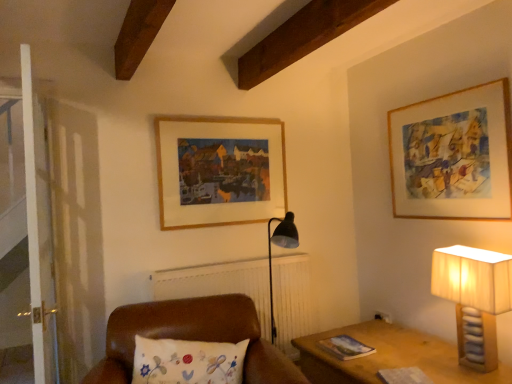
The image size is (512, 384). Describe the element at coordinates (474, 298) in the screenshot. I see `beige fabric lampshade at right` at that location.

The height and width of the screenshot is (384, 512). What do you see at coordinates (453, 155) in the screenshot?
I see `wooden frame at upper right, positioned as the 1th picture frame in right-to-left order` at bounding box center [453, 155].

The width and height of the screenshot is (512, 384). I want to click on leather cushion at center, so click(x=192, y=337).

The height and width of the screenshot is (384, 512). I want to click on beige fabric lampshade at right, so click(x=474, y=298).

Measure the distance from wooden picture frame at upper center, arranged as the 2th picture frame when viewed from the right, to beige fabric lampshade at right.

wooden picture frame at upper center, arranged as the 2th picture frame when viewed from the right, is 4.56 feet from beige fabric lampshade at right.

Where is `lamp below the wooden picture frame at upper center, placed as the first picture frame when sorted from left to right (from a real-world perspective)`? lamp below the wooden picture frame at upper center, placed as the first picture frame when sorted from left to right (from a real-world perspective) is located at coordinates (474, 298).

Looking at this image, from the image's perspective, which object appears higher, wooden picture frame at upper center, placed as the first picture frame when sorted from left to right, or beige fabric lampshade at right?

From the image's view, wooden picture frame at upper center, placed as the first picture frame when sorted from left to right, is above.

Could beige fabric lampshade at right be considered to be inside wooden picture frame at upper center, placed as the first picture frame when sorted from left to right?

No, wooden picture frame at upper center, placed as the first picture frame when sorted from left to right, does not contain beige fabric lampshade at right.

Is wooden frame at upper right, positioned as the 1th picture frame in right-to-left order, oriented away from wooden picture frame at upper center, placed as the first picture frame when sorted from left to right?

wooden frame at upper right, positioned as the 1th picture frame in right-to-left order, is not turned away from wooden picture frame at upper center, placed as the first picture frame when sorted from left to right.

Considering their positions, is wooden frame at upper right, positioned as the 1th picture frame in right-to-left order, located in front of or behind wooden picture frame at upper center, arranged as the 2th picture frame when viewed from the right?

Visually, wooden frame at upper right, positioned as the 1th picture frame in right-to-left order, is located in front of wooden picture frame at upper center, arranged as the 2th picture frame when viewed from the right.

Can you confirm if wooden frame at upper right, positioned as the 1th picture frame in right-to-left order, is positioned to the right of wooden picture frame at upper center, placed as the first picture frame when sorted from left to right?

Yes.

Can you tell me how much wooden frame at upper right, the second picture frame in the left-to-right sequence, and wooden picture frame at upper center, placed as the first picture frame when sorted from left to right, differ in facing direction?

The facing directions of wooden frame at upper right, the second picture frame in the left-to-right sequence, and wooden picture frame at upper center, placed as the first picture frame when sorted from left to right, are 90.2 degrees apart.

Is wooden frame at upper right, positioned as the 1th picture frame in right-to-left order, in contact with leather cushion at center?

No, wooden frame at upper right, positioned as the 1th picture frame in right-to-left order, is not making contact with leather cushion at center.

From the image's perspective, is wooden frame at upper right, the second picture frame in the left-to-right sequence, above or below leather cushion at center?

wooden frame at upper right, the second picture frame in the left-to-right sequence, is situated higher than leather cushion at center in the image.

Is wooden frame at upper right, positioned as the 1th picture frame in right-to-left order, closer to the viewer compared to leather cushion at center?

No, it is behind leather cushion at center.

Is point (242, 164) positioned after point (444, 132)?

Yes, point (242, 164) is behind point (444, 132).

Which object is positioned more to the right, wooden picture frame at upper center, placed as the first picture frame when sorted from left to right, or wooden frame at upper right, the second picture frame in the left-to-right sequence?

wooden frame at upper right, the second picture frame in the left-to-right sequence.

This screenshot has height=384, width=512. Find the location of `picture frame lying above the wooden picture frame at upper center, placed as the first picture frame when sorted from left to right (from the image's perspective)`. picture frame lying above the wooden picture frame at upper center, placed as the first picture frame when sorted from left to right (from the image's perspective) is located at coordinates (453, 155).

Is there a large distance between wooden picture frame at upper center, arranged as the 2th picture frame when viewed from the right, and wooden frame at upper right, positioned as the 1th picture frame in right-to-left order?

Yes, wooden picture frame at upper center, arranged as the 2th picture frame when viewed from the right, and wooden frame at upper right, positioned as the 1th picture frame in right-to-left order, are located far from each other.

Which is closer to the camera, (441, 269) or (486, 152)?

The point (441, 269) is closer.

From the image's perspective, which one is positioned higher, beige fabric lampshade at right or wooden frame at upper right, the second picture frame in the left-to-right sequence?

wooden frame at upper right, the second picture frame in the left-to-right sequence, is shown above in the image.

Can you confirm if beige fabric lampshade at right is positioned to the right of wooden frame at upper right, the second picture frame in the left-to-right sequence?

Yes.

Is beige fabric lampshade at right next to leather cushion at center?

There is a gap between beige fabric lampshade at right and leather cushion at center.

Which object is positioned more to the right, beige fabric lampshade at right or leather cushion at center?

beige fabric lampshade at right is more to the right.

Is beige fabric lampshade at right bigger than leather cushion at center?

No, beige fabric lampshade at right is not bigger than leather cushion at center.

Measure the distance from beige fabric lampshade at right to leather cushion at center.

beige fabric lampshade at right and leather cushion at center are 1.07 meters apart.

Is beige fabric lampshade at right located outside wooden picture frame at upper center, placed as the first picture frame when sorted from left to right?

Indeed, beige fabric lampshade at right is completely outside wooden picture frame at upper center, placed as the first picture frame when sorted from left to right.

Does beige fabric lampshade at right touch wooden picture frame at upper center, arranged as the 2th picture frame when viewed from the right?

beige fabric lampshade at right and wooden picture frame at upper center, arranged as the 2th picture frame when viewed from the right, are not in contact.

Considering the sizes of objects beige fabric lampshade at right and wooden picture frame at upper center, placed as the first picture frame when sorted from left to right, in the image provided, who is smaller, beige fabric lampshade at right or wooden picture frame at upper center, placed as the first picture frame when sorted from left to right,?

With smaller size is wooden picture frame at upper center, placed as the first picture frame when sorted from left to right.

Considering the relative positions of beige fabric lampshade at right and wooden picture frame at upper center, arranged as the 2th picture frame when viewed from the right, in the image provided, is beige fabric lampshade at right to the left or to the right of wooden picture frame at upper center, arranged as the 2th picture frame when viewed from the right,?

beige fabric lampshade at right is to the right of wooden picture frame at upper center, arranged as the 2th picture frame when viewed from the right.

Find the location of a particular element. The image size is (512, 384). lamp located underneath the wooden picture frame at upper center, placed as the first picture frame when sorted from left to right (from a real-world perspective) is located at coordinates (474, 298).

I want to click on picture frame above the wooden frame at upper right, the second picture frame in the left-to-right sequence (from a real-world perspective), so coord(219,170).

Considering their positions, is leather cushion at center positioned further to wooden picture frame at upper center, arranged as the 2th picture frame when viewed from the right, than beige fabric lampshade at right?

The object further to wooden picture frame at upper center, arranged as the 2th picture frame when viewed from the right, is beige fabric lampshade at right.

Estimate the real-world distances between objects in this image. Which object is further from leather cushion at center, wooden picture frame at upper center, arranged as the 2th picture frame when viewed from the right, or wooden frame at upper right, positioned as the 1th picture frame in right-to-left order?

The object further to leather cushion at center is wooden frame at upper right, positioned as the 1th picture frame in right-to-left order.

Which object lies further to the anchor point wooden frame at upper right, the second picture frame in the left-to-right sequence, leather cushion at center or beige fabric lampshade at right?

Among the two, leather cushion at center is located further to wooden frame at upper right, the second picture frame in the left-to-right sequence.

Which object lies nearer to the anchor point wooden picture frame at upper center, placed as the first picture frame when sorted from left to right, wooden frame at upper right, the second picture frame in the left-to-right sequence, or leather cushion at center?

Based on the image, leather cushion at center appears to be nearer to wooden picture frame at upper center, placed as the first picture frame when sorted from left to right.

Based on their spatial positions, is leather cushion at center or wooden picture frame at upper center, arranged as the 2th picture frame when viewed from the right, further from wooden frame at upper right, positioned as the 1th picture frame in right-to-left order?

leather cushion at center is positioned further to the anchor wooden frame at upper right, positioned as the 1th picture frame in right-to-left order.

Which object lies nearer to the anchor point wooden frame at upper right, positioned as the 1th picture frame in right-to-left order, beige fabric lampshade at right or wooden picture frame at upper center, arranged as the 2th picture frame when viewed from the right?

beige fabric lampshade at right is positioned closer to the anchor wooden frame at upper right, positioned as the 1th picture frame in right-to-left order.

Based on their spatial positions, is wooden picture frame at upper center, arranged as the 2th picture frame when viewed from the right, or beige fabric lampshade at right closer to leather cushion at center?

wooden picture frame at upper center, arranged as the 2th picture frame when viewed from the right, is positioned closer to the anchor leather cushion at center.

Based on their spatial positions, is wooden picture frame at upper center, placed as the first picture frame when sorted from left to right, or leather cushion at center further from wooden frame at upper right, the second picture frame in the left-to-right sequence?

leather cushion at center.

Where is `picture frame between wooden picture frame at upper center, placed as the first picture frame when sorted from left to right, and beige fabric lampshade at right`? The height and width of the screenshot is (384, 512). picture frame between wooden picture frame at upper center, placed as the first picture frame when sorted from left to right, and beige fabric lampshade at right is located at coordinates (453, 155).

At what (x,y) coordinates should I click in order to perform the action: click on picture frame between leather cushion at center and wooden frame at upper right, the second picture frame in the left-to-right sequence, in the horizontal direction. Please return your answer as a coordinate pair (x, y). Looking at the image, I should click on (219, 170).